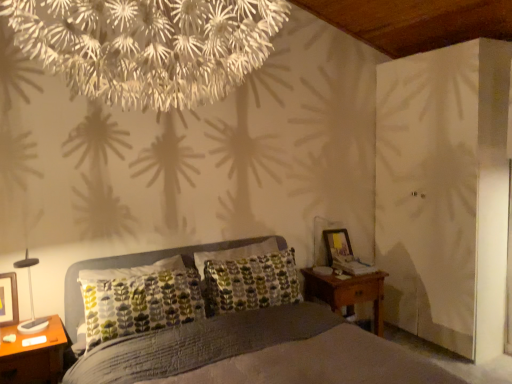
At what (x,y) coordinates should I click in order to perform the action: click on wooden nightstand at right, acting as the first nightstand starting from the right. Please return your answer as a coordinate pair (x, y). The width and height of the screenshot is (512, 384). Looking at the image, I should click on (347, 292).

This screenshot has height=384, width=512. What do you see at coordinates (148, 46) in the screenshot?
I see `white textured chandelier at upper center` at bounding box center [148, 46].

Identify the location of matte black picture frame at left, which is counted as the 1th picture frame, starting from the front. (8, 299).

Relative to white textured chandelier at upper center, is matte black lamp at left in front or behind?

Visually, matte black lamp at left is located behind white textured chandelier at upper center.

Does matte black lamp at left have a lesser height compared to white textured chandelier at upper center?

Correct, matte black lamp at left is not as tall as white textured chandelier at upper center.

Is white textured chandelier at upper center located within matte black lamp at left?

No.

Are wooden nightstand at lower left, the second nightstand in the right-to-left sequence, and matte black picture frame at left, which is counted as the 1th picture frame, starting from the front, making contact?

No.

From the picture: From the image's perspective, would you say wooden nightstand at lower left, positioned as the 2th nightstand in back-to-front order, is shown under matte black picture frame at left, which appears as the 1th picture frame when viewed from the left?

Yes.

From a real-world perspective, is wooden nightstand at lower left, positioned as the 2th nightstand in back-to-front order, beneath matte black picture frame at left, which appears as the 2th picture frame when viewed from the right?

Yes, from a real-world perspective, wooden nightstand at lower left, positioned as the 2th nightstand in back-to-front order, is beneath matte black picture frame at left, which appears as the 2th picture frame when viewed from the right.

Considering the positions of objects wooden nightstand at lower left, positioned as the 2th nightstand in back-to-front order, and matte black picture frame at left, which is counted as the 1th picture frame, starting from the front, in the image provided, who is more to the right, wooden nightstand at lower left, positioned as the 2th nightstand in back-to-front order, or matte black picture frame at left, which is counted as the 1th picture frame, starting from the front,?

Positioned to the right is wooden nightstand at lower left, positioned as the 2th nightstand in back-to-front order.

Which object is thinner, wooden picture frame at right, acting as the first picture frame starting from the back, or matte black lamp at left?

wooden picture frame at right, acting as the first picture frame starting from the back.

From the image's perspective, is wooden picture frame at right, placed as the 2th picture frame when sorted from front to back, above matte black lamp at left?

Yes, from the image's perspective, wooden picture frame at right, placed as the 2th picture frame when sorted from front to back, is on top of matte black lamp at left.

Is wooden picture frame at right, which ranks as the second picture frame in left-to-right order, positioned with its back to matte black lamp at left?

wooden picture frame at right, which ranks as the second picture frame in left-to-right order, does not have its back to matte black lamp at left.

Can you confirm if wooden picture frame at right, the first picture frame viewed from the right, is bigger than matte black lamp at left?

Actually, wooden picture frame at right, the first picture frame viewed from the right, might be smaller than matte black lamp at left.

Which is behind, point (174, 74) or point (338, 235)?

The point (338, 235) is farther from the camera.

Between white textured chandelier at upper center and wooden picture frame at right, acting as the first picture frame starting from the back, which one has less height?

Standing shorter between the two is wooden picture frame at right, acting as the first picture frame starting from the back.

Between white textured chandelier at upper center and wooden picture frame at right, placed as the 2th picture frame when sorted from front to back, which one appears on the right side from the viewer's perspective?

From the viewer's perspective, wooden picture frame at right, placed as the 2th picture frame when sorted from front to back, appears more on the right side.

Is textured gray bed at center positioned before wooden nightstand at right, the 1th nightstand from the back?

That is True.

Is textured gray bed at center beside wooden nightstand at right, which is the second nightstand from front to back?

They are not placed beside each other.

Where is `nightstand above the textured gray bed at center (from the image's perspective)`? This screenshot has height=384, width=512. nightstand above the textured gray bed at center (from the image's perspective) is located at coordinates (347, 292).

Between textured gray bed at center and wooden nightstand at right, the 1th nightstand from the back, which one appears on the left side from the viewer's perspective?

Positioned to the left is textured gray bed at center.

Where is `bed below the white textured chandelier at upper center (from a real-world perspective)`? The width and height of the screenshot is (512, 384). bed below the white textured chandelier at upper center (from a real-world perspective) is located at coordinates (x=261, y=352).

Is textured gray bed at center completely or partially outside of white textured chandelier at upper center?

Yes, textured gray bed at center is not within white textured chandelier at upper center.

Considering the sizes of objects textured gray bed at center and white textured chandelier at upper center in the image provided, who is shorter, textured gray bed at center or white textured chandelier at upper center?

white textured chandelier at upper center is shorter.

Would you say matte black picture frame at left, which is counted as the 1th picture frame, starting from the front, is outside wooden nightstand at right, which is the second nightstand from front to back?

Absolutely, matte black picture frame at left, which is counted as the 1th picture frame, starting from the front, is external to wooden nightstand at right, which is the second nightstand from front to back.

Looking at their sizes, would you say matte black picture frame at left, which is counted as the 1th picture frame, starting from the front, is wider or thinner than wooden nightstand at right, which is the second nightstand from front to back?

Considering their sizes, matte black picture frame at left, which is counted as the 1th picture frame, starting from the front, looks slimmer than wooden nightstand at right, which is the second nightstand from front to back.

Considering the positions of point (7, 311) and point (370, 301), is point (7, 311) closer or farther from the camera than point (370, 301)?

Point (7, 311) is positioned closer to the camera compared to point (370, 301).

Can you confirm if matte black picture frame at left, which appears as the 2th picture frame when viewed from the right, is bigger than wooden nightstand at right, which appears as the second nightstand when viewed from the left?

No, matte black picture frame at left, which appears as the 2th picture frame when viewed from the right, is not bigger than wooden nightstand at right, which appears as the second nightstand when viewed from the left.

Locate an element on the screen. flower that is above the matte black lamp at left (from a real-world perspective) is located at coordinates (148, 46).

From the image's perspective, starting from the wooden nightstand at lower left, positioned as the 2th nightstand in back-to-front order, which picture frame is the 1st one above? Please provide its 2D coordinates.

[(8, 299)]

From the image, which object appears to be farther from textured gray bed at center, wooden picture frame at right, acting as the first picture frame starting from the back, or matte black lamp at left?

wooden picture frame at right, acting as the first picture frame starting from the back, is further to textured gray bed at center.

Estimate the real-world distances between objects in this image. Which object is further from wooden nightstand at lower left, positioned as the 2th nightstand in back-to-front order, wooden picture frame at right, placed as the 2th picture frame when sorted from front to back, or white textured chandelier at upper center?

Among the two, wooden picture frame at right, placed as the 2th picture frame when sorted from front to back, is located further to wooden nightstand at lower left, positioned as the 2th nightstand in back-to-front order.

When comparing their distances from wooden nightstand at lower left, positioned as the 2th nightstand in back-to-front order, does matte black picture frame at left, which is the second picture frame from back to front, or textured gray bed at center seem further?

textured gray bed at center.

Looking at this image, when comparing their distances from wooden nightstand at right, which is the second nightstand from front to back, does wooden picture frame at right, the first picture frame viewed from the right, or white textured chandelier at upper center seem further?

white textured chandelier at upper center lies further to wooden nightstand at right, which is the second nightstand from front to back, than the other object.

When comparing their distances from wooden nightstand at lower left, positioned as the 2th nightstand in back-to-front order, does matte black lamp at left or matte black picture frame at left, which is the second picture frame from back to front, seem further?

matte black picture frame at left, which is the second picture frame from back to front, is further to wooden nightstand at lower left, positioned as the 2th nightstand in back-to-front order.

Which object lies nearer to the anchor point matte black lamp at left, wooden picture frame at right, acting as the first picture frame starting from the back, or white textured chandelier at upper center?

white textured chandelier at upper center is closer to matte black lamp at left.

When comparing their distances from matte black picture frame at left, which appears as the 2th picture frame when viewed from the right, does wooden picture frame at right, placed as the 2th picture frame when sorted from front to back, or wooden nightstand at right, acting as the first nightstand starting from the right, seem further?

Result: Based on the image, wooden picture frame at right, placed as the 2th picture frame when sorted from front to back, appears to be further to matte black picture frame at left, which appears as the 2th picture frame when viewed from the right.

When comparing their distances from wooden nightstand at right, acting as the first nightstand starting from the right, does wooden picture frame at right, the first picture frame viewed from the right, or wooden nightstand at lower left, which is the 1th nightstand in left-to-right order, seem closer?

wooden picture frame at right, the first picture frame viewed from the right.

Locate an element on the screen. picture frame between textured gray bed at center and wooden picture frame at right, the first picture frame viewed from the right, along the z-axis is located at coordinates (8, 299).

Locate an element on the screen. picture frame between matte black lamp at left and wooden nightstand at lower left, acting as the 1th nightstand starting from the front, in the vertical direction is located at coordinates (8, 299).

This screenshot has height=384, width=512. Identify the location of bedside lamp between white textured chandelier at upper center and wooden picture frame at right, which ranks as the second picture frame in left-to-right order, along the z-axis. (30, 299).

Identify the location of nightstand between matte black lamp at left and wooden picture frame at right, which ranks as the second picture frame in left-to-right order, in the horizontal direction. This screenshot has height=384, width=512. (347, 292).